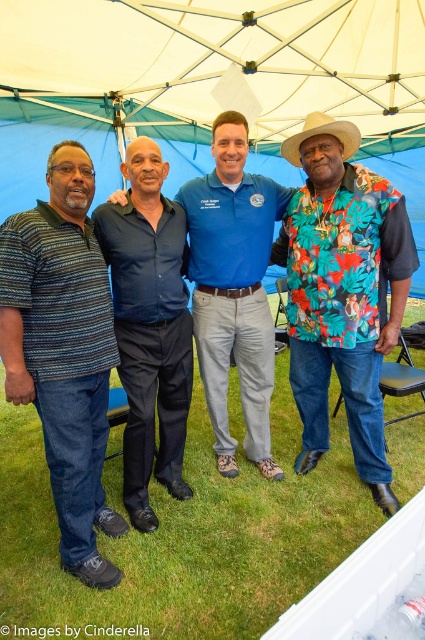
Question: Which point is closer to the camera?

Choices:
 (A) (319, 337)
 (B) (152, 323)
 (C) (93, 433)

Answer: (C)

Question: Estimate the real-world distances between objects in this image. Which object is farther from the floral fabric shirt at center?

Choices:
 (A) floral print shirt at right
 (B) dark blue shirt at center
 (C) striped polo shirt at left
 (D) blue fabric canopy at upper center

Answer: (D)

Question: Is floral print shirt at right bigger than dark blue shirt at center?

Choices:
 (A) no
 (B) yes

Answer: (B)

Question: Is striped polo shirt at left positioned before dark blue shirt at center?

Choices:
 (A) no
 (B) yes

Answer: (B)

Question: Based on their relative distances, which object is nearer to the floral print shirt at right?

Choices:
 (A) blue fabric canopy at upper center
 (B) dark blue shirt at center

Answer: (B)

Question: Does floral print shirt at right appear on the right side of floral fabric shirt at center?

Choices:
 (A) no
 (B) yes

Answer: (B)